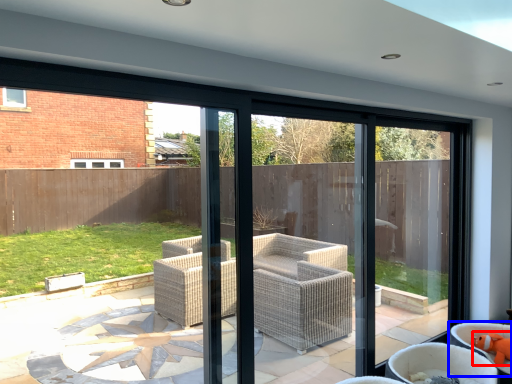
Question: Among these objects, which one is farthest to the camera, toy (highlighted by a red box) or chair (highlighted by a blue box)?

Choices:
 (A) toy
 (B) chair

Answer: (A)